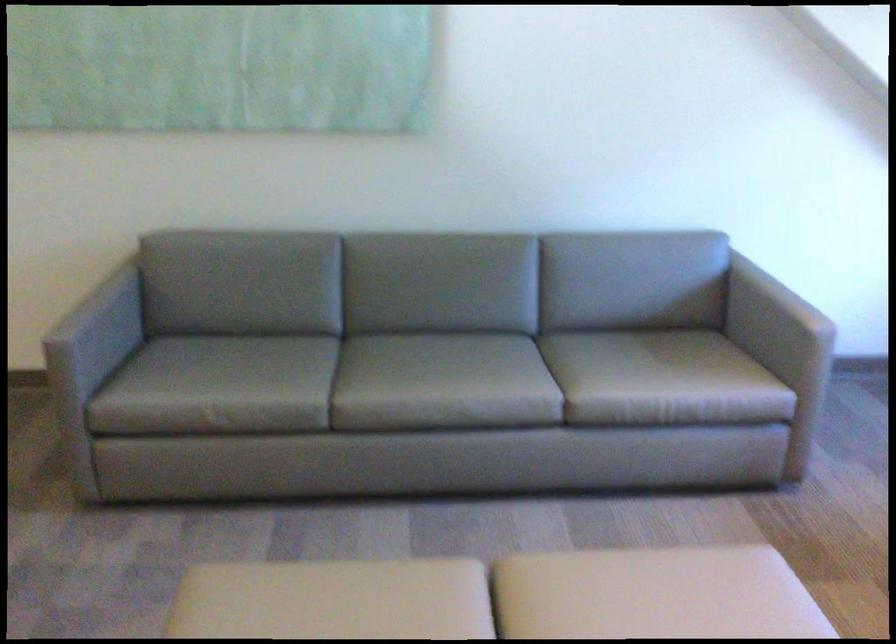
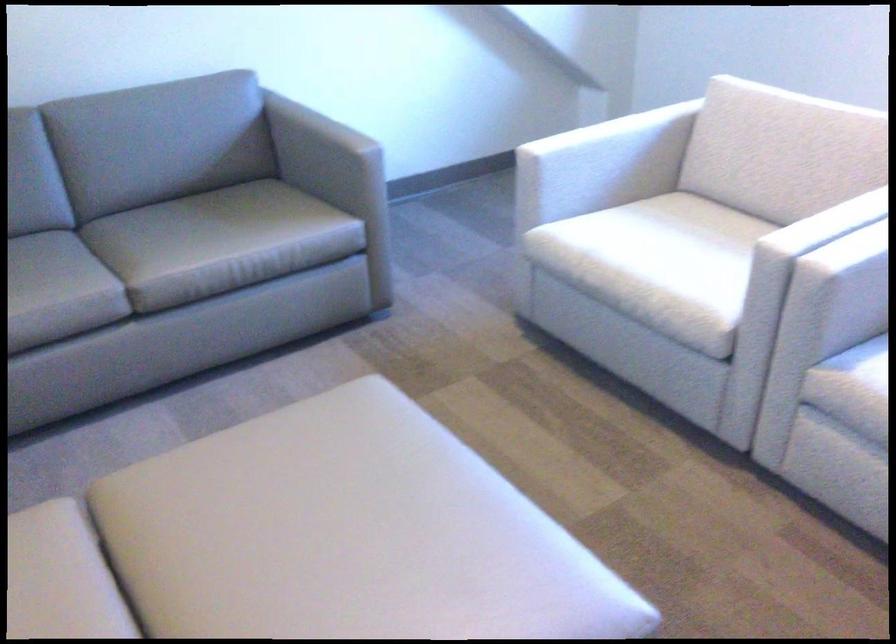
Question: The images are taken continuously from a first-person perspective. In which direction is your viewpoint rotating?

Choices:
 (A) Left
 (B) Right
 (C) Up
 (D) Down

Answer: (B)